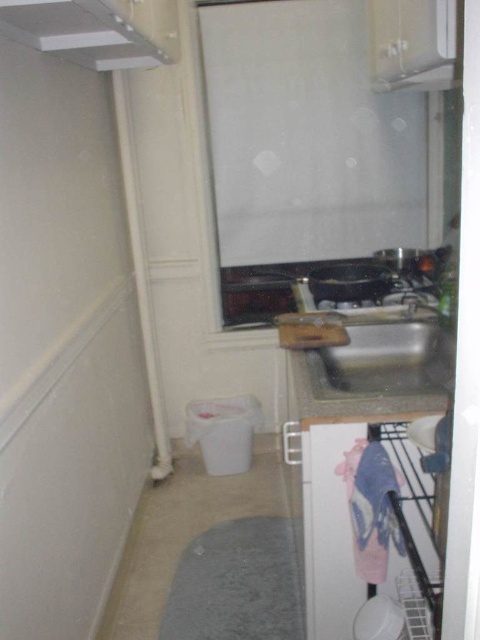
Does point (132, 44) come farther from viewer compared to point (365, 364)?

No, it is not.

Which is below, white matte exhaust hood at upper left or metallic sink at center?

metallic sink at center is lower down.

Is point (111, 29) positioned before point (398, 353)?

Yes, it is.

The height and width of the screenshot is (640, 480). Find the location of `white matte exhaust hood at upper left`. white matte exhaust hood at upper left is located at coordinates (96, 29).